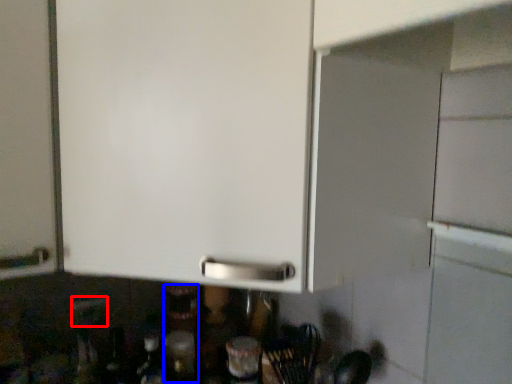
Question: Which object is closer to the camera taking this photo, electric outlet (highlighted by a red box) or bottle (highlighted by a blue box)?

Choices:
 (A) electric outlet
 (B) bottle

Answer: (A)